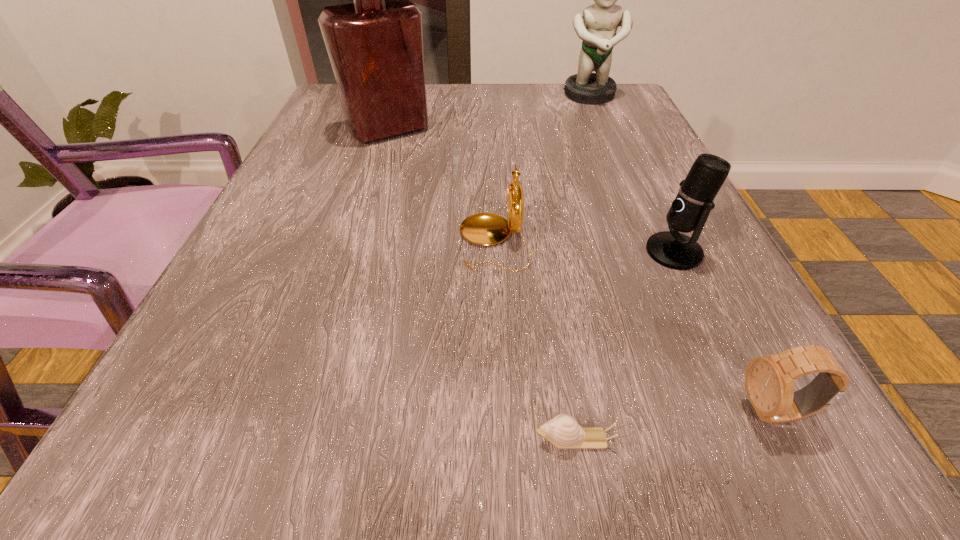
Identify the location of vacant space that satisfies the following two spatial constraints: 1. on the front-facing side of the microphone; 2. on the left side of the fifth shortest object. The height and width of the screenshot is (540, 960). (656, 252).